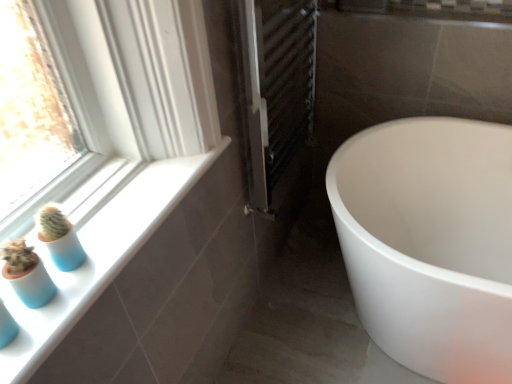
Image resolution: width=512 pixels, height=384 pixels. I want to click on free space above white glossy window sill at lower left (from a real-world perspective), so point(123,220).